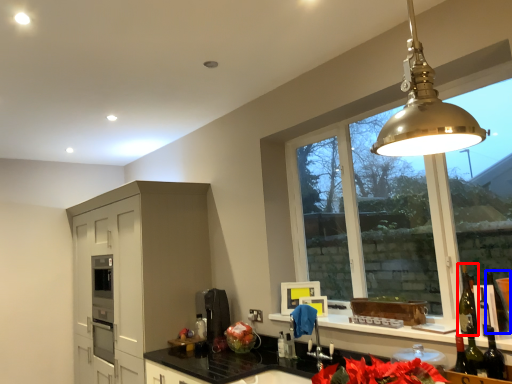
Question: Which object is further to the camera taking this photo, wine bottle (highlighted by a red box) or wine bottle (highlighted by a blue box)?

Choices:
 (A) wine bottle
 (B) wine bottle

Answer: (A)